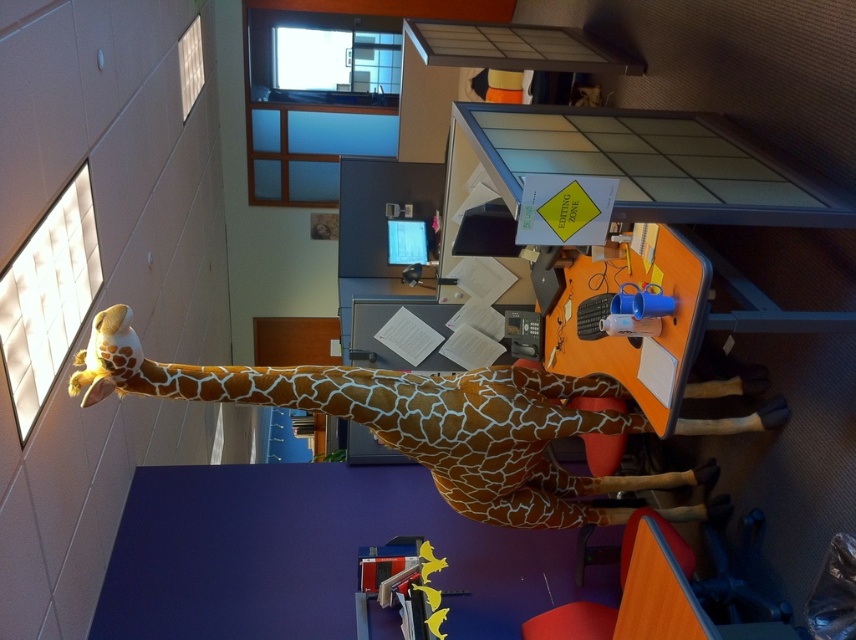
Question: Which of the following is the farthest from the observer?

Choices:
 (A) (431, 625)
 (B) (212, 372)

Answer: (A)

Question: Which of the following is the farthest from the observer?

Choices:
 (A) (394, 566)
 (B) (87, 396)

Answer: (A)

Question: Can you confirm if brown spotted plush giraffe at center is positioned to the left of yellow plastic toy at lower center?

Choices:
 (A) no
 (B) yes

Answer: (A)

Question: Can you confirm if brown spotted plush giraffe at center is positioned to the right of yellow plastic toy at lower center?

Choices:
 (A) no
 (B) yes

Answer: (B)

Question: Can you confirm if brown spotted plush giraffe at center is smaller than yellow plastic toy at lower center?

Choices:
 (A) yes
 (B) no

Answer: (B)

Question: Which point is closer to the camera?

Choices:
 (A) yellow plastic toy at lower center
 (B) brown spotted plush giraffe at center

Answer: (B)